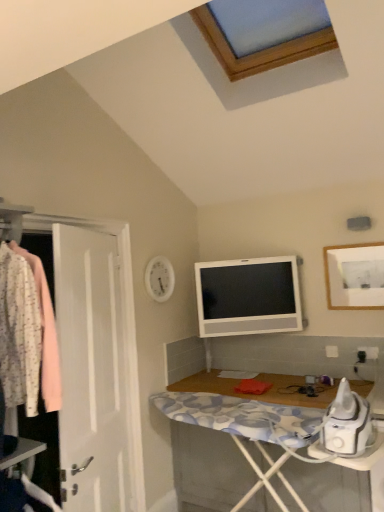
Question: Is white wood desk at lower right oriented away from white glossy television at upper center?

Choices:
 (A) yes
 (B) no

Answer: (B)

Question: Does white wood desk at lower right have a larger size compared to white glossy television at upper center?

Choices:
 (A) no
 (B) yes

Answer: (B)

Question: Is white wood desk at lower right not near white glossy television at upper center?

Choices:
 (A) yes
 (B) no

Answer: (B)

Question: Is the position of white wood desk at lower right more distant than that of white glossy television at upper center?

Choices:
 (A) no
 (B) yes

Answer: (A)

Question: Can you confirm if white wood desk at lower right is smaller than white glossy television at upper center?

Choices:
 (A) yes
 (B) no

Answer: (B)

Question: From a real-world perspective, is white glossy television at upper center physically located above or below white matte picture frame at upper right?

Choices:
 (A) below
 (B) above

Answer: (A)

Question: In the image, is white glossy television at upper center positioned in front of or behind white matte picture frame at upper right?

Choices:
 (A) behind
 (B) front

Answer: (A)

Question: In terms of width, does white glossy television at upper center look wider or thinner when compared to white matte picture frame at upper right?

Choices:
 (A) thin
 (B) wide

Answer: (B)

Question: Considering the positions of white glossy television at upper center and white matte picture frame at upper right in the image, is white glossy television at upper center taller or shorter than white matte picture frame at upper right?

Choices:
 (A) tall
 (B) short

Answer: (A)

Question: Is point (362, 267) positioned closer to the camera than point (190, 409)?

Choices:
 (A) closer
 (B) farther

Answer: (B)

Question: Is white matte picture frame at upper right spatially inside white wood desk at lower right, or outside of it?

Choices:
 (A) outside
 (B) inside

Answer: (A)

Question: Considering the positions of white matte picture frame at upper right and white wood desk at lower right in the image, is white matte picture frame at upper right wider or thinner than white wood desk at lower right?

Choices:
 (A) thin
 (B) wide

Answer: (A)

Question: From the image's perspective, is white matte picture frame at upper right positioned above or below white wood desk at lower right?

Choices:
 (A) below
 (B) above

Answer: (B)

Question: Based on their sizes in the image, would you say white matte picture frame at upper right is bigger or smaller than floral fabric shirt at left?

Choices:
 (A) small
 (B) big

Answer: (A)

Question: From the image's perspective, is white matte picture frame at upper right above or below floral fabric shirt at left?

Choices:
 (A) above
 (B) below

Answer: (A)